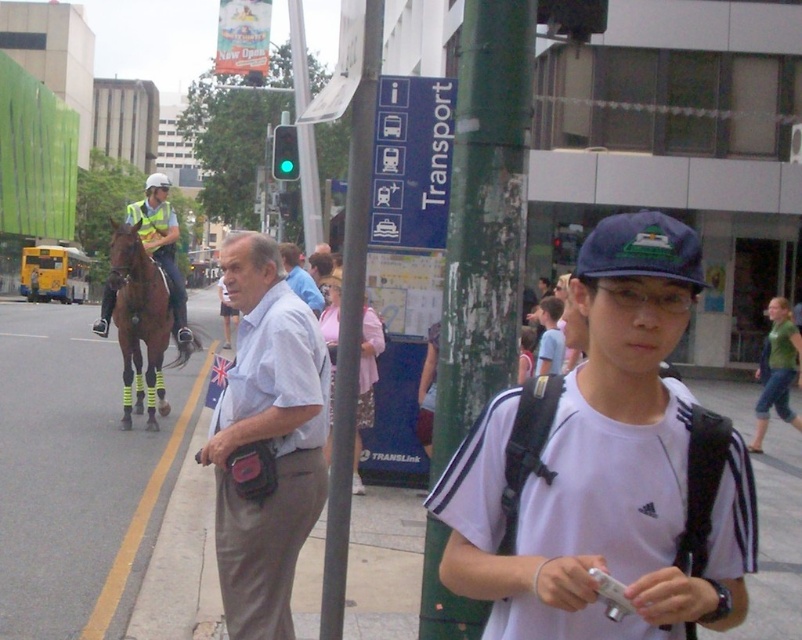
From the picture: How far apart are white matte shirt at center and blue plastic transport sign at upper center?

white matte shirt at center and blue plastic transport sign at upper center are 5.91 meters apart from each other.

Between white matte shirt at center and blue plastic transport sign at upper center, which one is positioned lower?

white matte shirt at center is lower down.

Looking at this image, measure the distance between point (x=754, y=506) and camera.

6.03 feet

This screenshot has height=640, width=802. In order to click on white matte shirt at center in this screenshot , I will do `click(602, 468)`.

Can you confirm if yellow asphalt at left is wider than brown glossy horse at left?

Indeed, yellow asphalt at left has a greater width compared to brown glossy horse at left.

Locate an element on the screen. This screenshot has width=802, height=640. yellow asphalt at left is located at coordinates (71, 472).

The height and width of the screenshot is (640, 802). I want to click on yellow asphalt at left, so (x=71, y=472).

Who is taller, green rough textured pole at center or brown glossy horse at left?

green rough textured pole at center

Between green rough textured pole at center and brown glossy horse at left, which one appears on the right side from the viewer's perspective?

green rough textured pole at center

Is point (464, 106) positioned behind point (189, 339)?

No, it is not.

In order to click on green rough textured pole at center in this screenshot , I will do `click(484, 216)`.